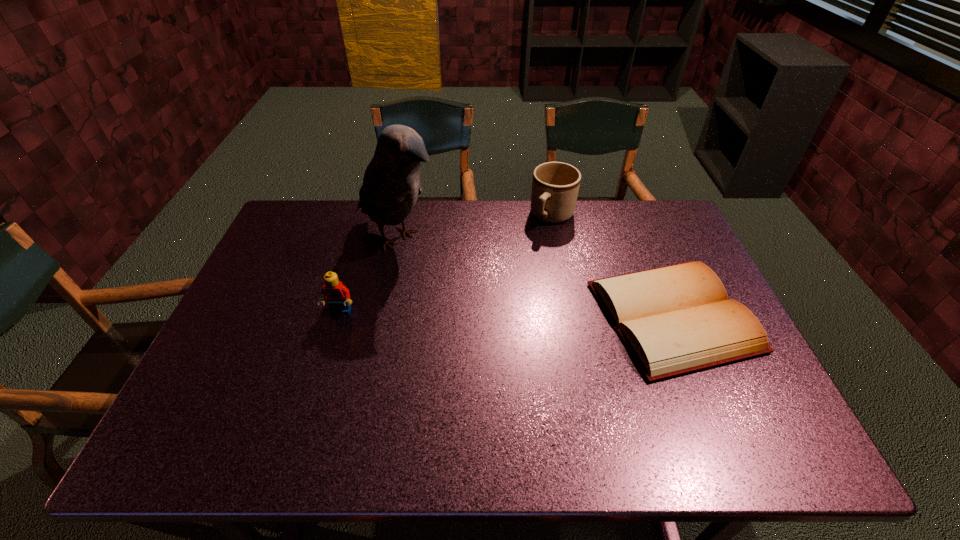
You are a GUI agent. You are given a task and a screenshot of the screen. Output one action in this format:
    pyautogui.click(x=<x>, y=<y>)
    Task: Click on the vacant area at the far left corner
    
    Given the screenshot: What is the action you would take?
    pyautogui.click(x=307, y=210)

The height and width of the screenshot is (540, 960). In the image, there is a desktop. Find the location of `vacant space at the far right corner`. vacant space at the far right corner is located at coordinates (658, 200).

Identify the location of free spot at the near right corner of the desktop. (764, 392).

This screenshot has width=960, height=540. I want to click on free spot between the Lego and the shortest object, so click(507, 314).

Where is `vacant space that's between the mug and the parrot`? This screenshot has width=960, height=540. vacant space that's between the mug and the parrot is located at coordinates (475, 228).

I want to click on free space between the Lego and the shortest object, so click(507, 314).

Locate an element on the screen. This screenshot has height=540, width=960. free space that is in between the Lego and the mug is located at coordinates (446, 264).

Identify the location of vacant area between the tallest object and the mug. (475, 228).

This screenshot has width=960, height=540. Identify the location of free space between the mug and the Bible. (612, 266).

Identify the location of free space between the shortest object and the Lego. Image resolution: width=960 pixels, height=540 pixels. (507, 314).